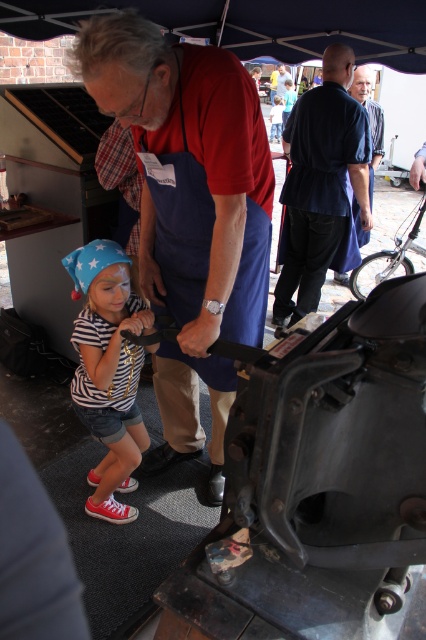
What are the coordinates of the dark blue fabric shirt at center?

The dark blue fabric shirt at center is located at coordinates point [321,182].

You are a delivery person who needs to place a package between the blue apron at center and the dark blue shirt at upper center. The package is 7 feet long. Can you fit it between them?

The blue apron at center is 6.93 feet away from the dark blue shirt at upper center. Since the package is 7 feet long, it cannot fit between them as the distance is slightly less than the package length.

Based on the photo, you are a fashion designer observing the man in the image. He is wearing a blue apron at center and a dark blue shirt at upper center. Which clothing item is closer to you?

The blue apron at center is closer to you because it is in front of the dark blue shirt at upper center.